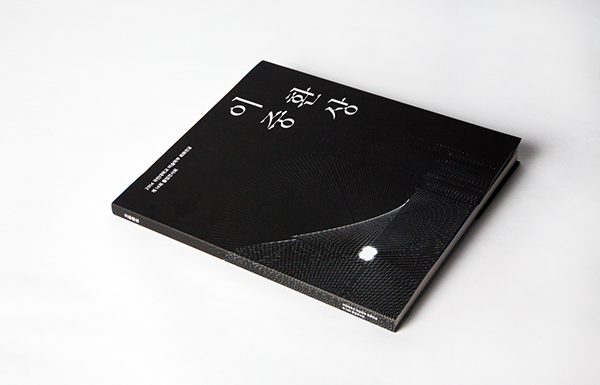
Locate an element on the screen. edge of book pages is located at coordinates (431, 275).